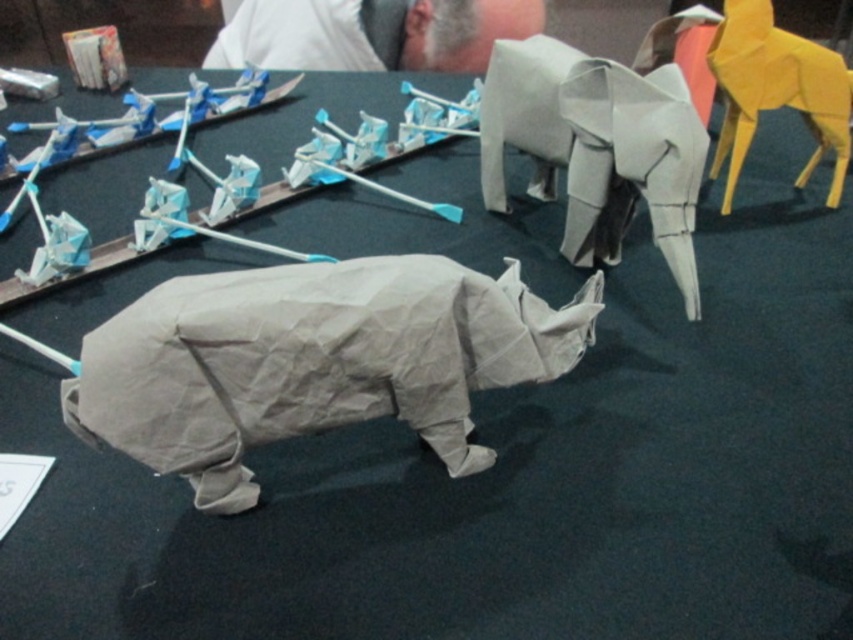
Question: Is gray paper elephant at center below yellow paper giraffe at upper right?

Choices:
 (A) yes
 (B) no

Answer: (A)

Question: Which of these objects is positioned closest to the gray paper rhino at center?

Choices:
 (A) gray paper elephant at center
 (B) yellow paper giraffe at upper right

Answer: (A)

Question: Which of the following is the farthest from the observer?

Choices:
 (A) gray paper rhino at center
 (B) gray paper elephant at center
 (C) white paper man at upper center
 (D) yellow paper giraffe at upper right

Answer: (C)

Question: Is gray paper rhino at center behind yellow paper giraffe at upper right?

Choices:
 (A) no
 (B) yes

Answer: (A)

Question: Can you confirm if gray paper rhino at center is positioned above gray paper elephant at center?

Choices:
 (A) yes
 (B) no

Answer: (B)

Question: Which point appears closest to the camera in this image?

Choices:
 (A) 570,83
 (B) 270,17
 (C) 763,100

Answer: (A)